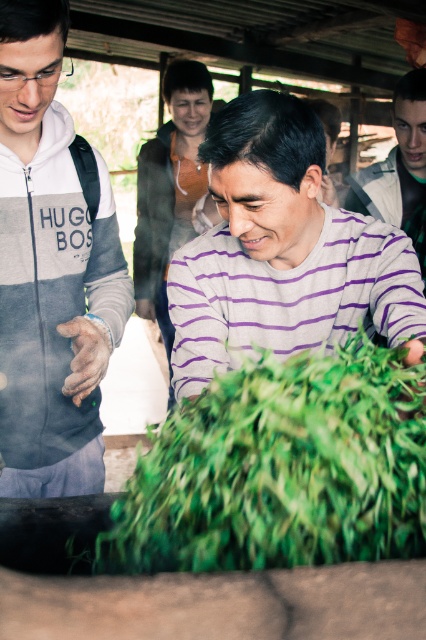
You are standing at the origin point in the image. Where is the green leafy vegetable at center located in terms of coordinates?

The green leafy vegetable at center is located at coordinates point (279, 468).

Based on the scene description, where is the green leafy vegetable at center in relation to the purple striped shirt at center?

The green leafy vegetable at center is to the left of the purple striped shirt at center.

Looking at the scene, which object is wider between the green leafy vegetable at center and the purple striped sweater at center?

The green leafy vegetable at center is wider than the purple striped sweater at center.